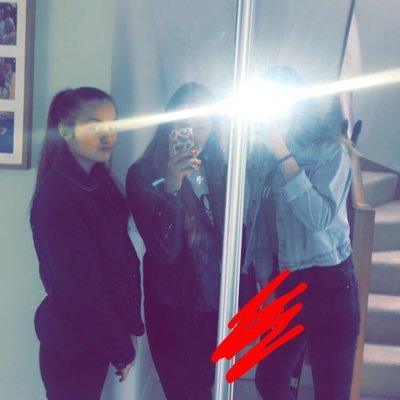
I want to click on collage frame right, so click(27, 75).